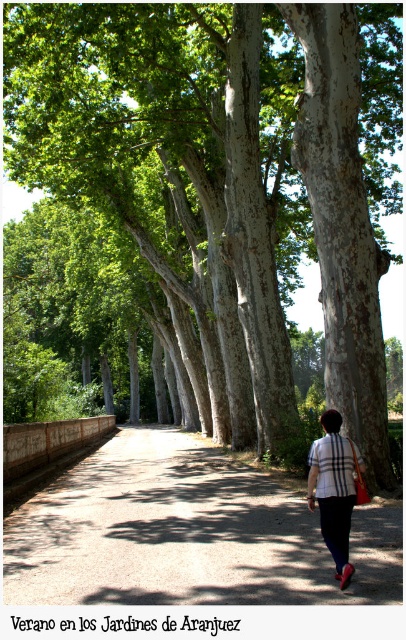
Can you confirm if dirt/gravel path at center is wider than plaid fabric shirt at center?

Yes, dirt/gravel path at center is wider than plaid fabric shirt at center.

Does dirt/gravel path at center have a larger size compared to plaid fabric shirt at center?

Correct, dirt/gravel path at center is larger in size than plaid fabric shirt at center.

Does point (71, 492) come in front of point (352, 508)?

No, it is not.

Find the location of `dirt/gravel path at center`. dirt/gravel path at center is located at coordinates (185, 532).